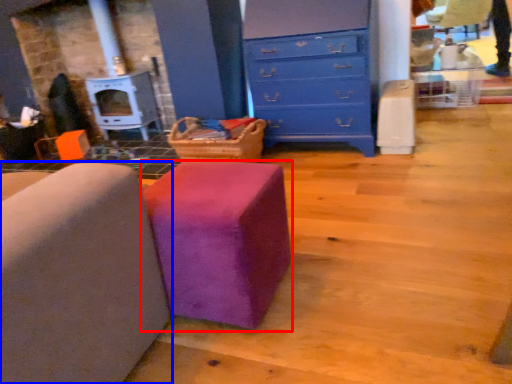
Question: Which object is further to the camera taking this photo, furniture (highlighted by a red box) or furniture (highlighted by a blue box)?

Choices:
 (A) furniture
 (B) furniture

Answer: (A)